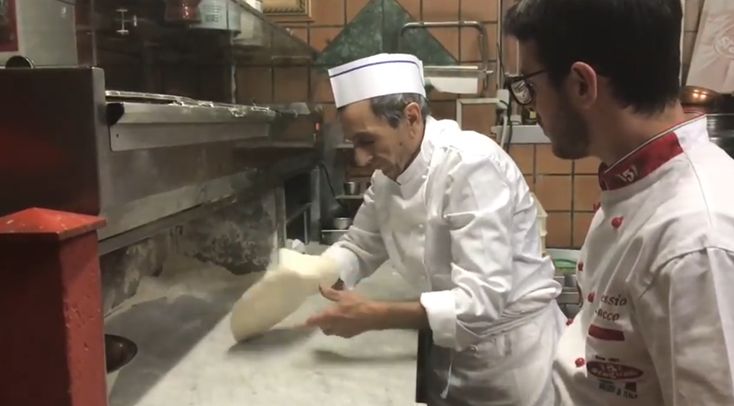
Locate an element on the screen. The height and width of the screenshot is (406, 734). copper container is located at coordinates (702, 96).